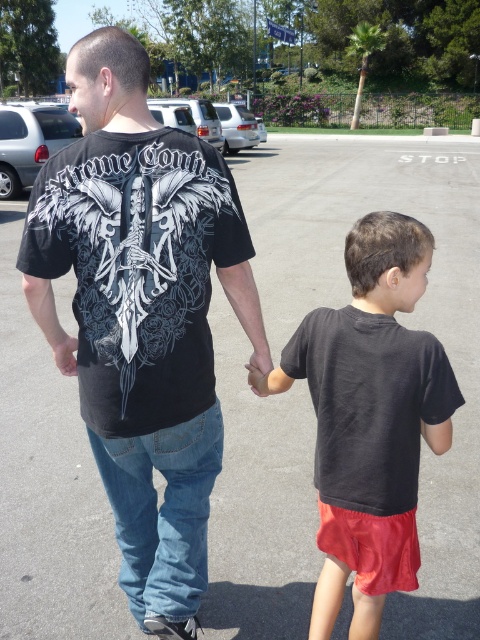
Question: Is black matte t-shirt at upper center below dark gray cotton shirt at center?

Choices:
 (A) no
 (B) yes

Answer: (A)

Question: Is black matte t-shirt at upper center to the left of dark gray cotton shirt at center from the viewer's perspective?

Choices:
 (A) no
 (B) yes

Answer: (B)

Question: Which object appears closest to the camera in this image?

Choices:
 (A) black matte t-shirt at center
 (B) dark gray cotton shirt at center
 (C) black matte t-shirt at upper center

Answer: (B)

Question: Among these objects, which one is nearest to the camera?

Choices:
 (A) black matte t-shirt at upper center
 (B) dark gray cotton shirt at center

Answer: (B)

Question: Which of the following is the closest to the observer?

Choices:
 (A) [107, 353]
 (B) [167, 595]
 (C) [393, 500]

Answer: (A)

Question: Does black matte t-shirt at center have a lesser width compared to black matte t-shirt at upper center?

Choices:
 (A) yes
 (B) no

Answer: (B)